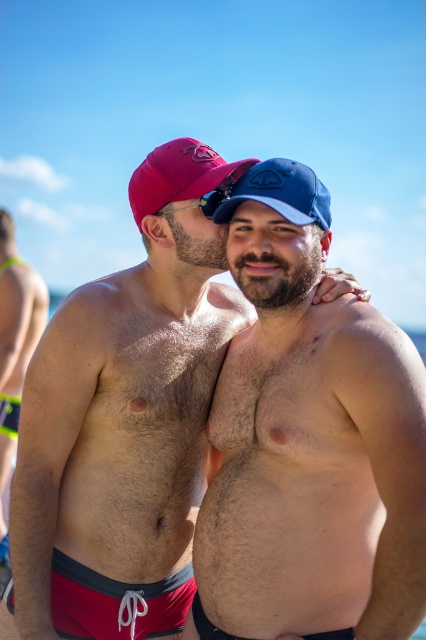
Does red fabric shorts at lower left have a larger size compared to neon green swim trunks at left?

No, red fabric shorts at lower left is not bigger than neon green swim trunks at left.

Is red fabric shorts at lower left smaller than neon green swim trunks at left?

Yes, red fabric shorts at lower left is smaller than neon green swim trunks at left.

Is point (54, 589) positioned before point (6, 342)?

Yes, it is.

Find the location of a particular element. red fabric shorts at lower left is located at coordinates (115, 602).

Is point (166, 209) positioned behind point (184, 600)?

No, it is in front of (184, 600).

Is matte red swim trunks at center wider than red fabric shorts at lower left?

Yes, matte red swim trunks at center is wider than red fabric shorts at lower left.

Between point (187, 509) and point (120, 602), which one is positioned in front?

Point (120, 602) is more forward.

Identify the location of matte red swim trunks at center. This screenshot has height=640, width=426. [124, 420].

Does matte red baseball cap at upper center appear under blue fabric baseball cap at upper center?

No.

Can you confirm if matte red baseball cap at upper center is bigger than blue fabric baseball cap at upper center?

Yes, matte red baseball cap at upper center is bigger than blue fabric baseball cap at upper center.

Image resolution: width=426 pixels, height=640 pixels. Find the location of `matte red baseball cap at upper center`. matte red baseball cap at upper center is located at coordinates (178, 173).